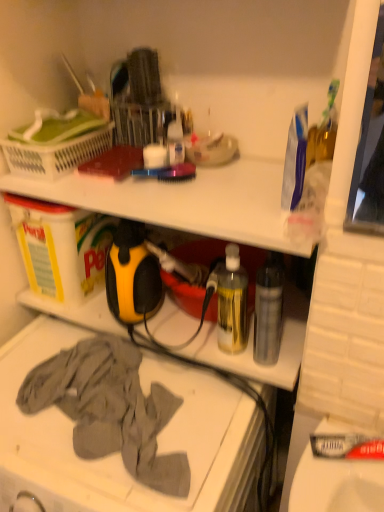
The image size is (384, 512). Find the location of `free space to the left of translucent plastic bottle at center, placed as the 2th bottle when sorted from right to left`. free space to the left of translucent plastic bottle at center, placed as the 2th bottle when sorted from right to left is located at coordinates 176,338.